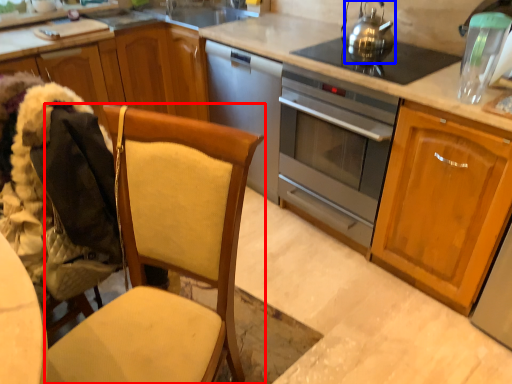
Question: Which of the following is the farthest to the observer, chair (highlighted by a red box) or tea pot (highlighted by a blue box)?

Choices:
 (A) chair
 (B) tea pot

Answer: (B)